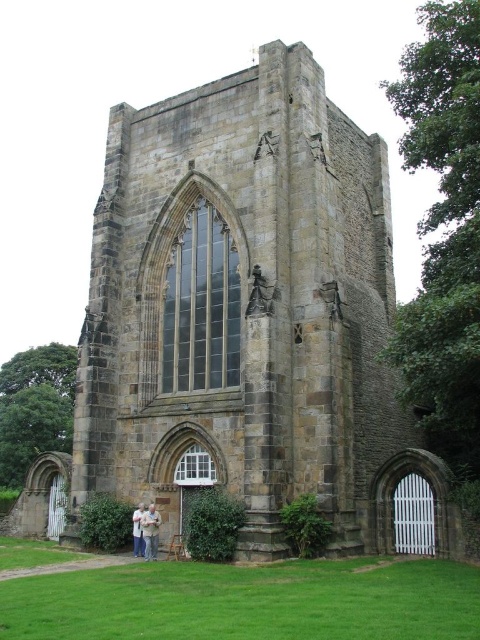
You are standing in front of a historic stone building with a Gothic window. You see green grass at lower center and a white fabric shirt at lower center. Which object takes up more space in the image?

The green grass at lower center takes up more space in the image because it has a larger size compared to the white fabric shirt at lower center.

You are standing at the base of the historic stone structure and want to place a 30 meter long decorative banner between the green grass at lower center and the smaller arched opening to the right of the window. Will the banner be long enough to stretch between them?

The distance between the green grass at lower center and the smaller arched opening to the right of the window is 26.89 meters. Since the banner is 30 meters long, it will be long enough to stretch between them with some extra length remaining.